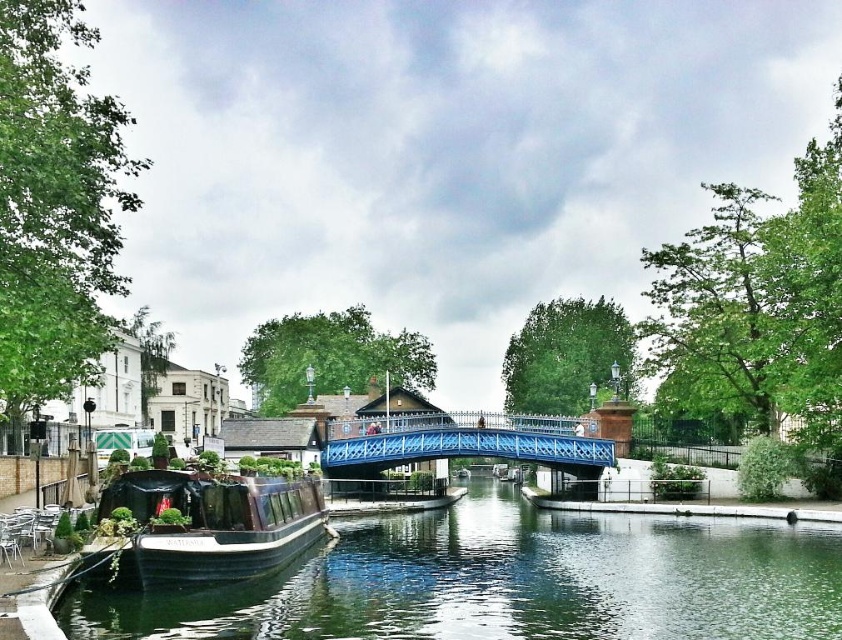
Based on the photo, you are a tour guide leading a group of visitors who want to walk from the wooden polished boat at lower left to the blue metallic bridge at center. The group includes a person with a mobility scooter that can travel 40 meters. Can they reach the bridge without needing to recharge the scooter?

The wooden polished boat at lower left and blue metallic bridge at center are 44.62 meters apart from each other. Since the scooter can travel 40 meters, it cannot reach the bridge without recharging as the distance is greater than the scooter can cover.

You are standing at the edge of the canal and want to take a photo of the two points marked in the image. Which point, point (611, 518) or point (611, 451), will appear larger in your photo?

Point (611, 518) will appear larger in the photo because it is closer to the camera than point (611, 451).

You are standing at the edge of the canal and want to reach the point marked as point (419, 600). Given that your maximum walking distance is 80 meters, can you reach it?

The point (419, 600) is 79.62 meters from the viewer, so yes, you can reach it since it is within your 80 meter limit.